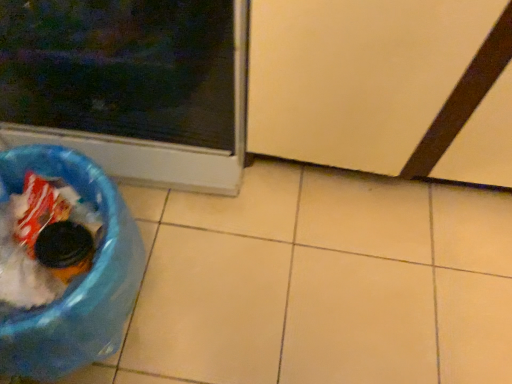
Question: Is transparent plastic screen door at lower right outside of matte plastic trash can at lower left?

Choices:
 (A) yes
 (B) no

Answer: (A)

Question: Is transparent plastic screen door at lower right oriented away from matte plastic trash can at lower left?

Choices:
 (A) yes
 (B) no

Answer: (B)

Question: Could you tell me if transparent plastic screen door at lower right is turned towards matte plastic trash can at lower left?

Choices:
 (A) yes
 (B) no

Answer: (B)

Question: Is transparent plastic screen door at lower right placed right next to matte plastic trash can at lower left?

Choices:
 (A) no
 (B) yes

Answer: (A)

Question: Does transparent plastic screen door at lower right lie in front of matte plastic trash can at lower left?

Choices:
 (A) yes
 (B) no

Answer: (B)

Question: Based on their sizes in the image, would you say transparent plastic screen door at lower right is bigger or smaller than matte plastic trash can at lower left?

Choices:
 (A) big
 (B) small

Answer: (A)

Question: Is transparent plastic screen door at lower right taller or shorter than matte plastic trash can at lower left?

Choices:
 (A) short
 (B) tall

Answer: (A)

Question: From the image's perspective, relative to matte plastic trash can at lower left, is transparent plastic screen door at lower right above or below?

Choices:
 (A) above
 (B) below

Answer: (B)

Question: In terms of width, does transparent plastic screen door at lower right look wider or thinner when compared to matte plastic trash can at lower left?

Choices:
 (A) thin
 (B) wide

Answer: (A)

Question: Considering the positions of point (50, 345) and point (449, 28), is point (50, 345) closer or farther from the camera than point (449, 28)?

Choices:
 (A) farther
 (B) closer

Answer: (B)

Question: Considering their positions, is blue plastic recycling bin at lower left located in front of or behind transparent plastic screen door at lower right?

Choices:
 (A) behind
 (B) front

Answer: (A)

Question: From the image's perspective, is blue plastic recycling bin at lower left positioned above or below transparent plastic screen door at lower right?

Choices:
 (A) below
 (B) above

Answer: (A)

Question: Based on their sizes in the image, would you say blue plastic recycling bin at lower left is bigger or smaller than transparent plastic screen door at lower right?

Choices:
 (A) small
 (B) big

Answer: (A)

Question: From their relative heights in the image, would you say transparent plastic screen door at lower right is taller or shorter than blue plastic recycling bin at lower left?

Choices:
 (A) short
 (B) tall

Answer: (B)

Question: Choose the correct answer: Is transparent plastic screen door at lower right inside blue plastic recycling bin at lower left or outside it?

Choices:
 (A) inside
 (B) outside

Answer: (B)